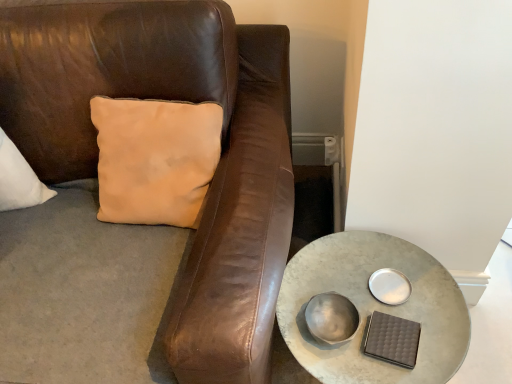
Question: In terms of width, does metallic silver bowl at lower center look wider or thinner when compared to metallic gray table at lower right?

Choices:
 (A) wide
 (B) thin

Answer: (B)

Question: Is point [x=311, y=306] positioned closer to the camera than point [x=309, y=347]?

Choices:
 (A) farther
 (B) closer

Answer: (A)

Question: Visually, is metallic silver bowl at lower center positioned to the left or to the right of metallic gray table at lower right?

Choices:
 (A) left
 (B) right

Answer: (A)

Question: Does point (372, 309) appear closer or farther from the camera than point (324, 314)?

Choices:
 (A) closer
 (B) farther

Answer: (B)

Question: Would you say metallic gray table at lower right is inside or outside metallic silver bowl at lower center?

Choices:
 (A) inside
 (B) outside

Answer: (B)

Question: From their relative heights in the image, would you say metallic gray table at lower right is taller or shorter than metallic silver bowl at lower center?

Choices:
 (A) short
 (B) tall

Answer: (B)

Question: Based on their positions, is metallic gray table at lower right located to the left or right of metallic silver bowl at lower center?

Choices:
 (A) right
 (B) left

Answer: (A)